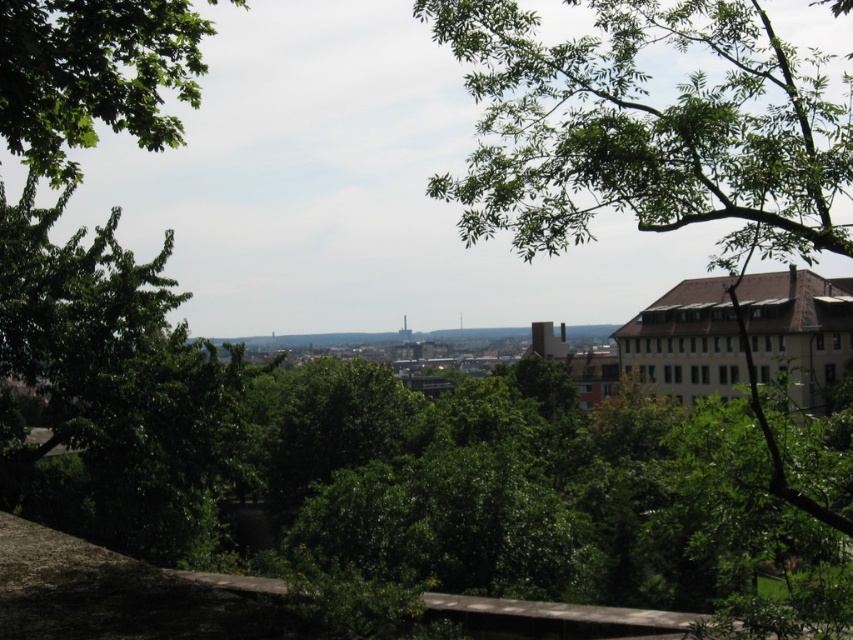
Is point (837, 525) positioned behind point (50, 141)?

No, (837, 525) is closer to viewer.

Does green leafy tree at upper center come behind green leafy tree at upper left?

Yes, green leafy tree at upper center is further from the viewer.

Between point (585, 160) and point (194, 19), which one is positioned in front?

Point (585, 160)

Locate an element on the screen. The height and width of the screenshot is (640, 853). green leafy tree at upper center is located at coordinates (651, 141).